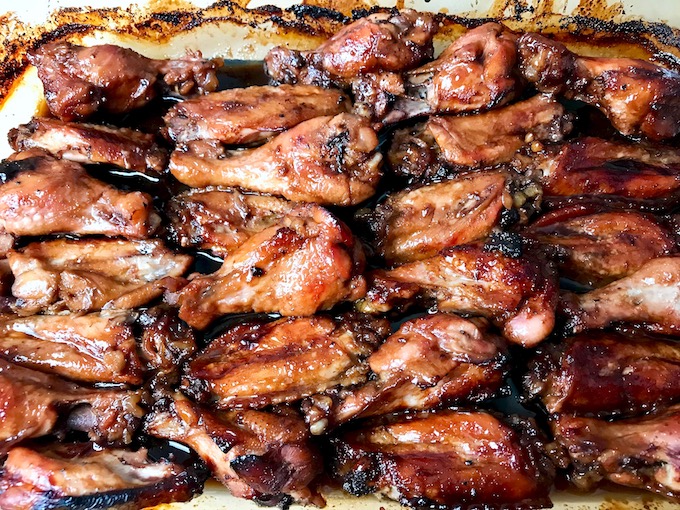
The height and width of the screenshot is (510, 680). I want to click on back side of dish, so click(277, 0).